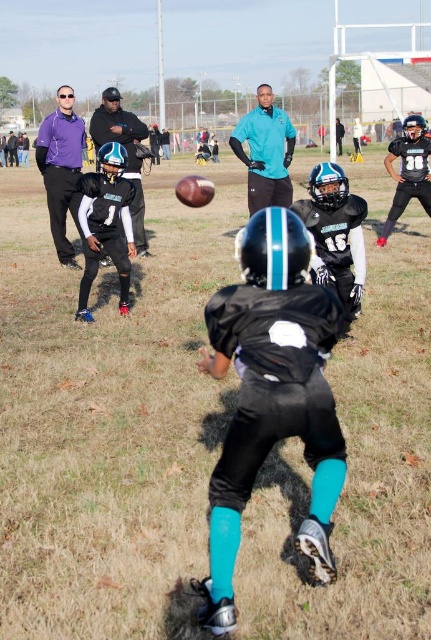
Is teal synthetic jacket at center wider than matte black helmet at center?

No.

Looking at this image, who is shorter, teal synthetic jacket at center or matte black helmet at center?

teal synthetic jacket at center

This screenshot has width=431, height=640. I want to click on teal synthetic jacket at center, so click(x=265, y=150).

Looking at this image, is black matte football at center wider than teal synthetic jacket at center?

Incorrect, black matte football at center's width does not surpass teal synthetic jacket at center's.

Between point (318, 333) and point (289, 118), which one is positioned in front?

Positioned in front is point (318, 333).

The image size is (431, 640). Find the location of `black matte football at center`. black matte football at center is located at coordinates (271, 394).

Is purple matte shirt at left to the left of matte black helmet at center from the viewer's perspective?

Indeed, purple matte shirt at left is positioned on the left side of matte black helmet at center.

Identify the location of purple matte shirt at left. This screenshot has height=640, width=431. (61, 168).

At what (x,y) coordinates should I click in order to perform the action: click on purple matte shirt at left. Please return your answer as a coordinate pair (x, y). Image resolution: width=431 pixels, height=640 pixels. Looking at the image, I should click on (61, 168).